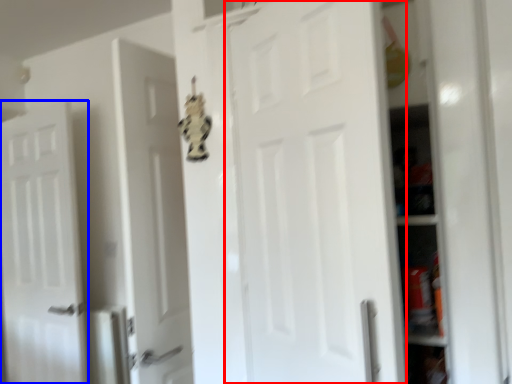
Question: Which of the following is the farthest to the observer, door (highlighted by a red box) or door (highlighted by a blue box)?

Choices:
 (A) door
 (B) door

Answer: (B)